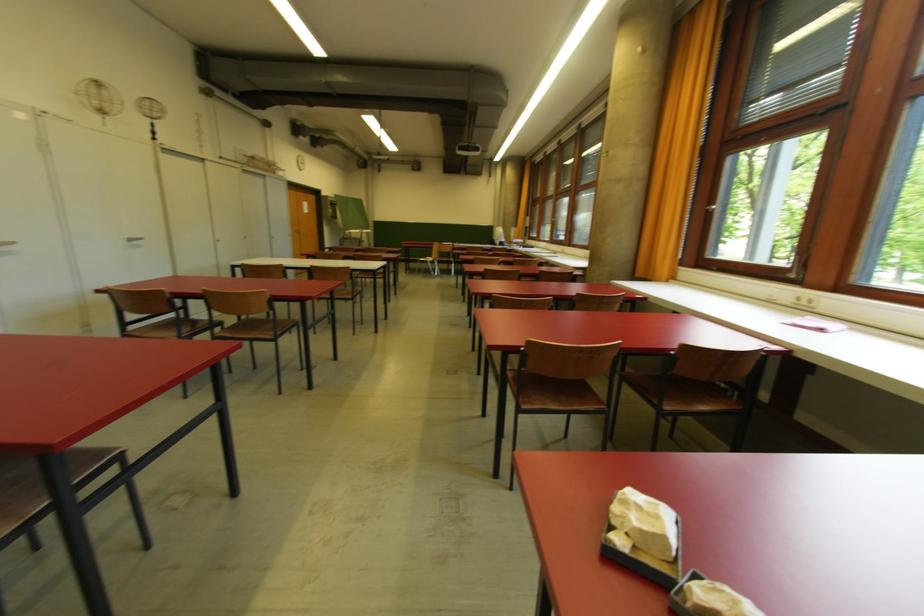
Find where to pull the window handle. Please return your answer as a coordinate pair (x, y).

(721, 217)